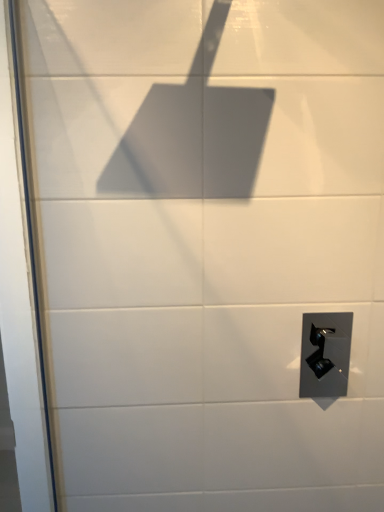
Question: Is point (339, 320) closer or farther from the camera than point (18, 308)?

Choices:
 (A) closer
 (B) farther

Answer: (B)

Question: From the image's perspective, is satin black door handle at lower right positioned above or below transparent glass screen door at left?

Choices:
 (A) below
 (B) above

Answer: (A)

Question: Considering the positions of satin black door handle at lower right and transparent glass screen door at left in the image, is satin black door handle at lower right taller or shorter than transparent glass screen door at left?

Choices:
 (A) short
 (B) tall

Answer: (A)

Question: Does point (8, 349) appear closer or farther from the camera than point (311, 364)?

Choices:
 (A) farther
 (B) closer

Answer: (B)

Question: In terms of width, does transparent glass screen door at left look wider or thinner when compared to satin black door handle at lower right?

Choices:
 (A) thin
 (B) wide

Answer: (B)

Question: Considering the positions of transparent glass screen door at left and satin black door handle at lower right in the image, is transparent glass screen door at left bigger or smaller than satin black door handle at lower right?

Choices:
 (A) big
 (B) small

Answer: (A)

Question: From a real-world perspective, is transparent glass screen door at left positioned above or below satin black door handle at lower right?

Choices:
 (A) below
 (B) above

Answer: (B)